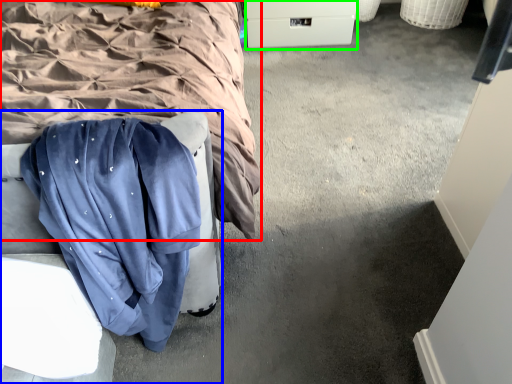
Question: Which object is positioned closest to bed (highlighted by a red box)? Select from furniture (highlighted by a blue box) and drawer (highlighted by a green box).

Choices:
 (A) furniture
 (B) drawer

Answer: (A)